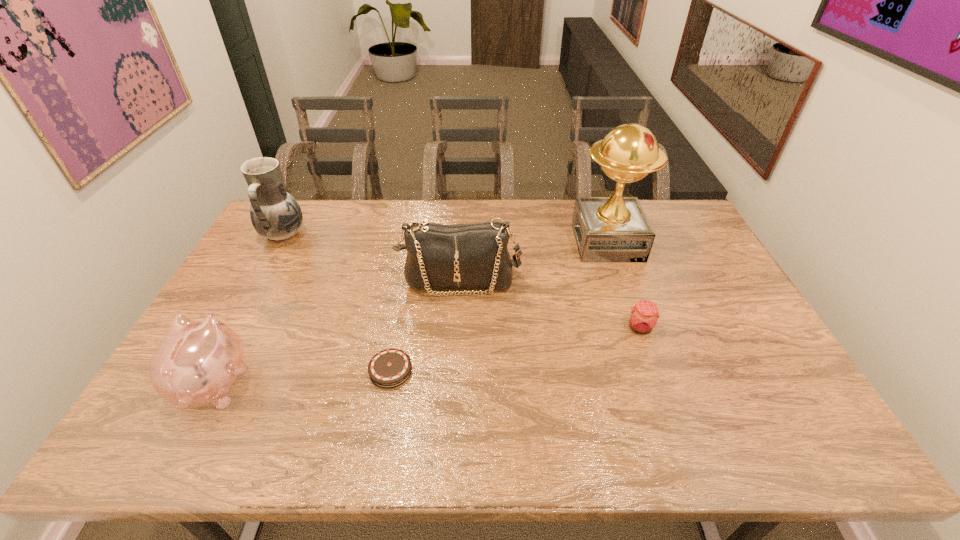
This screenshot has height=540, width=960. Identify the location of free area in between the chocolate cake and the third nearest object. (516, 349).

Identify which object is the fifth nearest to the pitcher. Please provide its 2D coordinates. Your answer should be formatted as a tuple, i.e. [(x, y)], where the tuple contains the x and y coordinates of a point satisfying the conditions above.

[(643, 318)]

Identify which object is located as the third nearest to the chocolate cake. Please provide its 2D coordinates. Your answer should be formatted as a tuple, i.e. [(x, y)], where the tuple contains the x and y coordinates of a point satisfying the conditions above.

[(275, 214)]

Identify the location of free spot that satisfies the following two spatial constraints: 1. on the back side of the chocolate cake; 2. on the left side of the second shortest object. Image resolution: width=960 pixels, height=540 pixels. (398, 328).

Where is `free space that satisfies the following two spatial constraints: 1. on the back side of the jam; 2. on the left side of the shortest object`? free space that satisfies the following two spatial constraints: 1. on the back side of the jam; 2. on the left side of the shortest object is located at coordinates (398, 328).

Where is `free location that satisfies the following two spatial constraints: 1. on the front-facing side of the pitcher; 2. on the front facing side of the piggy bank`? The height and width of the screenshot is (540, 960). free location that satisfies the following two spatial constraints: 1. on the front-facing side of the pitcher; 2. on the front facing side of the piggy bank is located at coordinates (202, 382).

The height and width of the screenshot is (540, 960). I want to click on vacant area in the image that satisfies the following two spatial constraints: 1. on the front-facing side of the tallest object; 2. at the front of the handbag with chain and zipper, so click(x=621, y=281).

At what (x,y) coordinates should I click in order to perform the action: click on vacant space that satisfies the following two spatial constraints: 1. on the front-facing side of the award; 2. at the front of the third tallest object with chain and zipper. Please return your answer as a coordinate pair (x, y). Image resolution: width=960 pixels, height=540 pixels. Looking at the image, I should click on click(x=621, y=281).

Find the location of a particular element. blank space that satisfies the following two spatial constraints: 1. on the front-facing side of the pitcher; 2. on the right side of the shortest object is located at coordinates (208, 370).

Where is `vacant space that satisfies the following two spatial constraints: 1. on the front facing side of the fourth tallest object; 2. on the front-facing side of the pitcher`? vacant space that satisfies the following two spatial constraints: 1. on the front facing side of the fourth tallest object; 2. on the front-facing side of the pitcher is located at coordinates (293, 235).